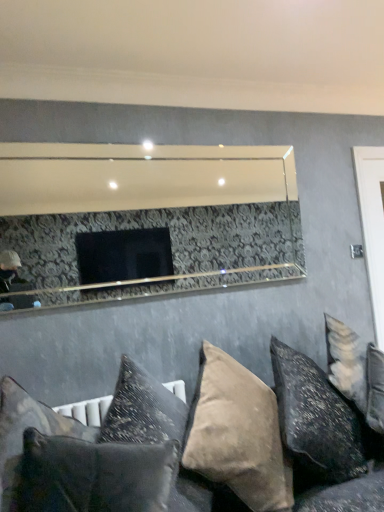
Question: Considering the relative positions of suede-like beige pillow at lower center, arranged as the second pillow when viewed from the right, and textured gray pillow at lower center, which is the 2th pillow from left to right, in the image provided, is suede-like beige pillow at lower center, arranged as the second pillow when viewed from the right, to the left of textured gray pillow at lower center, which is the 2th pillow from left to right, from the viewer's perspective?

Choices:
 (A) no
 (B) yes

Answer: (A)

Question: Does suede-like beige pillow at lower center, arranged as the second pillow when viewed from the right, come in front of textured gray pillow at lower center, acting as the fourth pillow starting from the right?

Choices:
 (A) no
 (B) yes

Answer: (A)

Question: Does suede-like beige pillow at lower center, arranged as the second pillow when viewed from the right, touch textured gray pillow at lower center, which is the 2th pillow from left to right?

Choices:
 (A) yes
 (B) no

Answer: (B)

Question: Considering the relative positions of suede-like beige pillow at lower center, arranged as the second pillow when viewed from the right, and textured gray pillow at lower center, which is the 2th pillow from left to right, in the image provided, is suede-like beige pillow at lower center, arranged as the second pillow when viewed from the right, to the right of textured gray pillow at lower center, which is the 2th pillow from left to right, from the viewer's perspective?

Choices:
 (A) yes
 (B) no

Answer: (A)

Question: From a real-world perspective, is suede-like beige pillow at lower center, which is counted as the 4th pillow, starting from the left, on top of textured gray pillow at lower center, acting as the fourth pillow starting from the right?

Choices:
 (A) no
 (B) yes

Answer: (A)

Question: Is point (231, 486) positioned closer to the camera than point (54, 416)?

Choices:
 (A) closer
 (B) farther

Answer: (B)

Question: Considering the positions of velvet cushions at lower center and velvet dark gray pillow at lower left, the fifth pillow when ordered from right to left, in the image, is velvet cushions at lower center taller or shorter than velvet dark gray pillow at lower left, the fifth pillow when ordered from right to left,?

Choices:
 (A) tall
 (B) short

Answer: (A)

Question: Is velvet cushions at lower center wider or thinner than velvet dark gray pillow at lower left, the fifth pillow when ordered from right to left?

Choices:
 (A) thin
 (B) wide

Answer: (B)

Question: Visually, is velvet cushions at lower center positioned to the left or to the right of velvet dark gray pillow at lower left, acting as the first pillow starting from the left?

Choices:
 (A) left
 (B) right

Answer: (B)

Question: Which is correct: velvet dark gray pillow at lower left, acting as the first pillow starting from the left, is inside velvet cushions at lower center, or outside of it?

Choices:
 (A) outside
 (B) inside

Answer: (A)

Question: From the image's perspective, relative to velvet cushions at lower center, is velvet dark gray pillow at lower left, the fifth pillow when ordered from right to left, above or below?

Choices:
 (A) below
 (B) above

Answer: (B)

Question: Considering the relative positions of velvet dark gray pillow at lower left, acting as the first pillow starting from the left, and velvet cushions at lower center in the image provided, is velvet dark gray pillow at lower left, acting as the first pillow starting from the left, to the left or to the right of velvet cushions at lower center?

Choices:
 (A) left
 (B) right

Answer: (A)

Question: From a real-world perspective, is velvet dark gray pillow at lower left, the fifth pillow when ordered from right to left, physically located above or below velvet cushions at lower center?

Choices:
 (A) below
 (B) above

Answer: (B)

Question: Would you say velvet dark gray pillow at lower left, acting as the first pillow starting from the left, is inside or outside velvet beige pillow at lower right, arranged as the 5th pillow when viewed from the left?

Choices:
 (A) outside
 (B) inside

Answer: (A)

Question: Looking at their shapes, would you say velvet dark gray pillow at lower left, the fifth pillow when ordered from right to left, is wider or thinner than velvet beige pillow at lower right, acting as the first pillow starting from the right?

Choices:
 (A) wide
 (B) thin

Answer: (B)